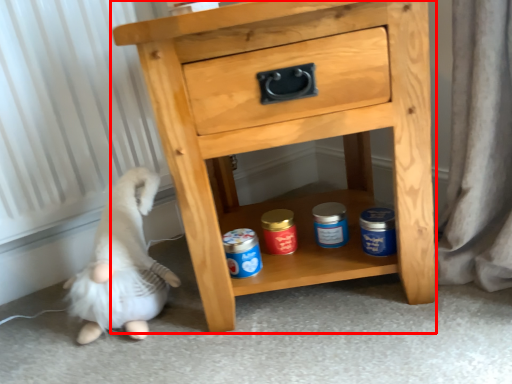
Question: From the image's perspective, considering the relative positions of chest of drawers (annotated by the red box) and animal in the image provided, where is chest of drawers (annotated by the red box) located with respect to the staircase?

Choices:
 (A) above
 (B) below

Answer: (A)